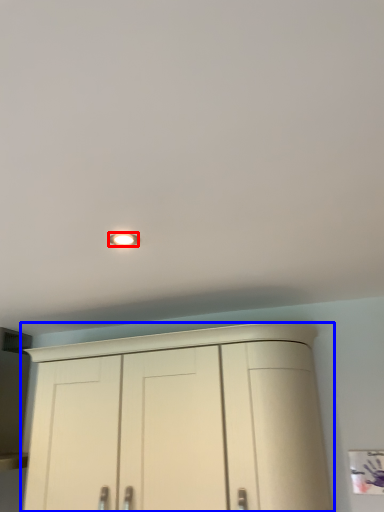
Question: Which of the following is the closest to the observer, lighting (highlighted by a red box) or cupboard (highlighted by a blue box)?

Choices:
 (A) lighting
 (B) cupboard

Answer: (A)